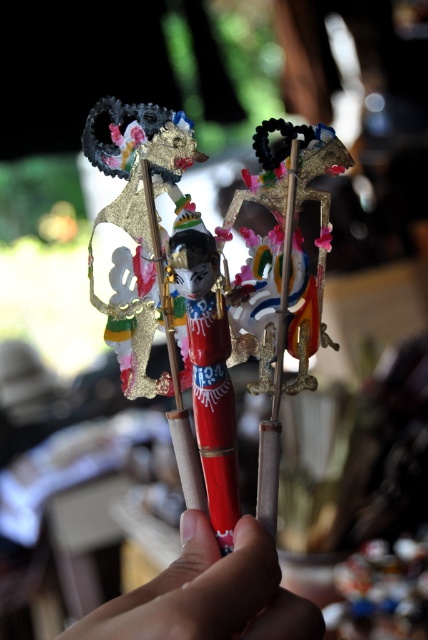
Which is below, gold metallic puppet at center or shiny red pen at center?

Positioned lower is shiny red pen at center.

Find the location of a particular element. gold metallic puppet at center is located at coordinates (288, 272).

Which is above, smooth skin hand at center or gold metallic puppet at center?

gold metallic puppet at center is higher up.

Which is more to the left, smooth skin hand at center or gold metallic puppet at center?

From the viewer's perspective, smooth skin hand at center appears more on the left side.

Is point (177, 628) more distant than point (272, 493)?

No.

I want to click on smooth skin hand at center, so click(208, 595).

Can you confirm if smooth skin hand at center is wider than shiny red pen at center?

Yes, smooth skin hand at center is wider than shiny red pen at center.

Can you confirm if smooth skin hand at center is positioned below shiny red pen at center?

Correct, smooth skin hand at center is located below shiny red pen at center.

Between point (237, 625) and point (201, 364), which one is positioned in front?

Point (237, 625) is more forward.

At what (x,y) coordinates should I click in order to perform the action: click on smooth skin hand at center. Please return your answer as a coordinate pair (x, y). This screenshot has width=428, height=640. Looking at the image, I should click on (208, 595).